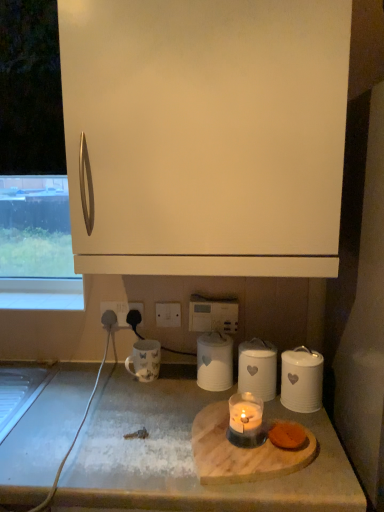
This screenshot has height=512, width=384. In order to click on free location above white rubber cable at lower left (from a real-world perspective) in this screenshot , I will do `click(36, 409)`.